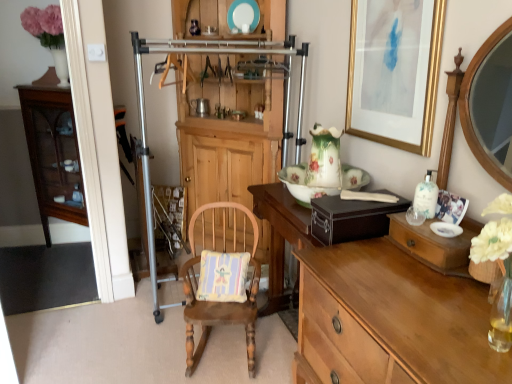
Question: From a real-world perspective, is teal glossy plate at upper center, the first plate positioned from the back, above or below pastel striped fabric pillow at center?

Choices:
 (A) above
 (B) below

Answer: (A)

Question: From the image's perspective, is teal glossy plate at upper center, the second plate from the front, above or below pastel striped fabric pillow at center?

Choices:
 (A) below
 (B) above

Answer: (B)

Question: Which is farther from the light brown wood desk at center?

Choices:
 (A) metallic silver coffee cup at center
 (B) mahogany glass-front cabinet at left, the second cabinetry from the right
 (C) wooden rocking chair with cushion at center
 (D) wooden dresser at center
 (E) gold-framed artwork at upper right

Answer: (A)

Question: Which is nearer to the wooden dresser at center?

Choices:
 (A) floral porcelain plate at center, placed as the 2th plate when sorted from back to front
 (B) metallic silver coffee cup at center
 (C) white glossy bottle at upper right
 (D) light brown wood desk at center
 (E) wooden rocking chair with cushion at center

Answer: (B)